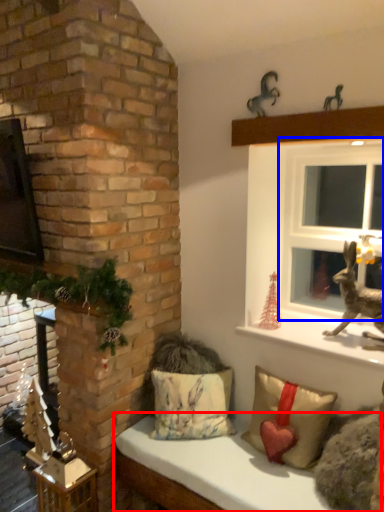
Question: Among these objects, which one is nearest to the camera, furniture (highlighted by a red box) or window (highlighted by a blue box)?

Choices:
 (A) furniture
 (B) window

Answer: (A)